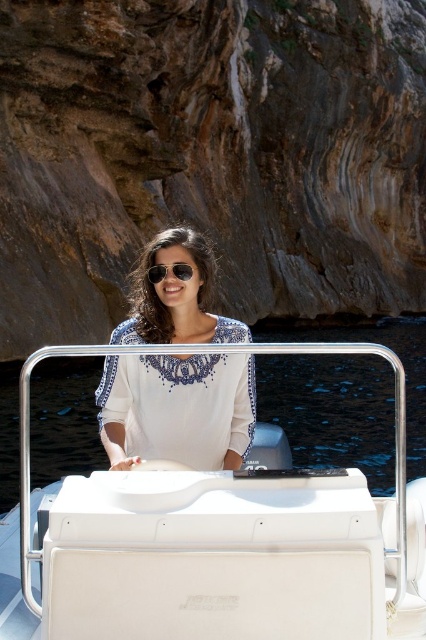
You are a photographer taking a portrait of the woman in the motorboat. You need to ensure that both the white embroidered blouse at center and the matte black sunglasses at center are clearly visible in the frame. Which object should you focus on to ensure both are in focus, considering their sizes?

The white embroidered blouse at center is wider than the matte black sunglasses at center, so focusing on the blouse will ensure both are in focus as it occupies more space in the frame.

You are a photographer taking a portrait of the woman in the motorboat. You need to focus on either the white embroidered blouse at center or the matte black sunglasses at center. Which object should you choose to ensure the subject is in sharp focus?

You should focus on the white embroidered blouse at center because it is closer to the viewer than the matte black sunglasses at center, ensuring the subject is in sharp focus.

You are a photographer trying to capture a photo of the white embroidered blouse at center and the matte brown rock at center. Which object should you focus on first if you want to ensure both are in the frame without moving the camera?

The matte brown rock at center might be wider than the white embroidered blouse at center, so you should focus on the matte brown rock at center first to ensure it fits within the frame.